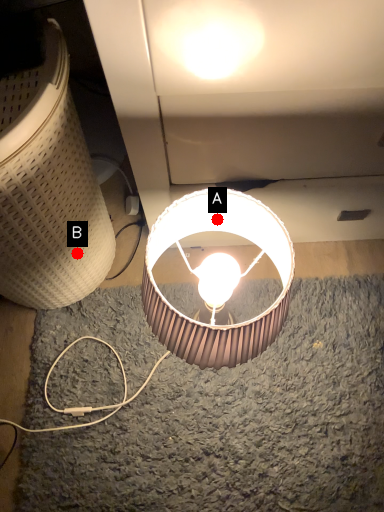
Question: Two points are circled on the image, labeled by A and B beside each circle. Which point appears closest to the camera in this image?

Choices:
 (A) A is closer
 (B) B is closer

Answer: (A)